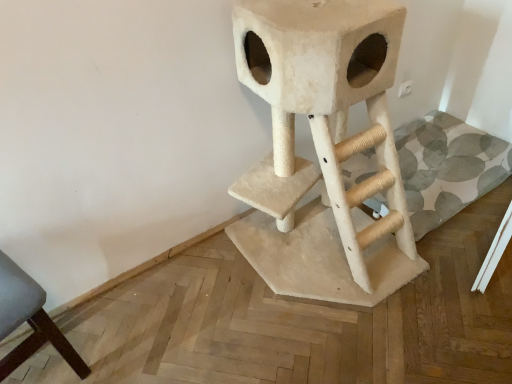
This screenshot has width=512, height=384. Identify the location of beige carpeted cat tree at center. (323, 149).

The width and height of the screenshot is (512, 384). Describe the element at coordinates (323, 149) in the screenshot. I see `beige carpeted cat tree at center` at that location.

Measure the distance between point (3, 269) and camera.

The depth of point (3, 269) is 3.75 feet.

Locate an element on the screen. dark gray fabric chair at lower left is located at coordinates (29, 320).

What do you see at coordinates (29, 320) in the screenshot? I see `dark gray fabric chair at lower left` at bounding box center [29, 320].

Measure the distance between dark gray fabric chair at lower left and camera.

dark gray fabric chair at lower left and camera are 3.39 feet apart from each other.

In order to click on beige carpeted cat tree at center in this screenshot , I will do `click(323, 149)`.

Considering the positions of objects dark gray fabric chair at lower left and beige carpeted cat tree at center in the image provided, who is more to the right, dark gray fabric chair at lower left or beige carpeted cat tree at center?

beige carpeted cat tree at center is more to the right.

Is dark gray fabric chair at lower left in front of or behind beige carpeted cat tree at center in the image?

Visually, dark gray fabric chair at lower left is located behind beige carpeted cat tree at center.

Is point (34, 351) closer or farther from the camera than point (324, 270)?

Point (34, 351) appears to be closer to the viewer than point (324, 270).

From the image's perspective, is dark gray fabric chair at lower left on top of beige carpeted cat tree at center?

No, from the image's perspective, dark gray fabric chair at lower left is not on top of beige carpeted cat tree at center.

From a real-world perspective, does dark gray fabric chair at lower left stand above beige carpeted cat tree at center?

No.

Is dark gray fabric chair at lower left wider than beige carpeted cat tree at center?

Incorrect, the width of dark gray fabric chair at lower left does not surpass that of beige carpeted cat tree at center.

In terms of height, does dark gray fabric chair at lower left look taller or shorter compared to beige carpeted cat tree at center?

Clearly, dark gray fabric chair at lower left is shorter compared to beige carpeted cat tree at center.

Who is bigger, dark gray fabric chair at lower left or beige carpeted cat tree at center?

beige carpeted cat tree at center is bigger.

Is beige carpeted cat tree at center completely or partially inside dark gray fabric chair at lower left?

No, beige carpeted cat tree at center is not surrounded by dark gray fabric chair at lower left.

Is there a large distance between dark gray fabric chair at lower left and beige carpeted cat tree at center?

No, dark gray fabric chair at lower left is not far away from beige carpeted cat tree at center.

Is dark gray fabric chair at lower left looking in the opposite direction of beige carpeted cat tree at center?

No, beige carpeted cat tree at center is not at the back of dark gray fabric chair at lower left.

Identify the location of chair that is behind the beige carpeted cat tree at center. (29, 320).

Considering the positions of objects beige carpeted cat tree at center and dark gray fabric chair at lower left in the image provided, who is more to the right, beige carpeted cat tree at center or dark gray fabric chair at lower left?

Positioned to the right is beige carpeted cat tree at center.

Which is behind, beige carpeted cat tree at center or dark gray fabric chair at lower left?

dark gray fabric chair at lower left is behind.

Is point (316, 295) closer or farther from the camera than point (8, 293)?

Point (316, 295) appears to be farther away from the viewer than point (8, 293).

From the image's perspective, which one is positioned lower, beige carpeted cat tree at center or dark gray fabric chair at lower left?

From the image's view, dark gray fabric chair at lower left is below.

From a real-world perspective, is beige carpeted cat tree at center over dark gray fabric chair at lower left?

Yes.

Considering the sizes of objects beige carpeted cat tree at center and dark gray fabric chair at lower left in the image provided, who is wider, beige carpeted cat tree at center or dark gray fabric chair at lower left?

With larger width is beige carpeted cat tree at center.

Considering the relative sizes of beige carpeted cat tree at center and dark gray fabric chair at lower left in the image provided, is beige carpeted cat tree at center taller than dark gray fabric chair at lower left?

Yes, beige carpeted cat tree at center is taller than dark gray fabric chair at lower left.

Does beige carpeted cat tree at center have a smaller size compared to dark gray fabric chair at lower left?

No.

Is beige carpeted cat tree at center not inside dark gray fabric chair at lower left?

Yes.

Is beige carpeted cat tree at center positioned far away from dark gray fabric chair at lower left?

No, beige carpeted cat tree at center is not far away from dark gray fabric chair at lower left.

Based on the photo, is beige carpeted cat tree at center facing away from dark gray fabric chair at lower left?

No.

Where is `bar stool on the right side of dark gray fabric chair at lower left`? The width and height of the screenshot is (512, 384). bar stool on the right side of dark gray fabric chair at lower left is located at coordinates (323, 149).

At what (x,y) coordinates should I click in order to perform the action: click on bar stool above the dark gray fabric chair at lower left (from a real-world perspective). Please return your answer as a coordinate pair (x, y). This screenshot has height=384, width=512. Looking at the image, I should click on (323, 149).

Locate an element on the screen. The height and width of the screenshot is (384, 512). chair below the beige carpeted cat tree at center (from a real-world perspective) is located at coordinates (29, 320).